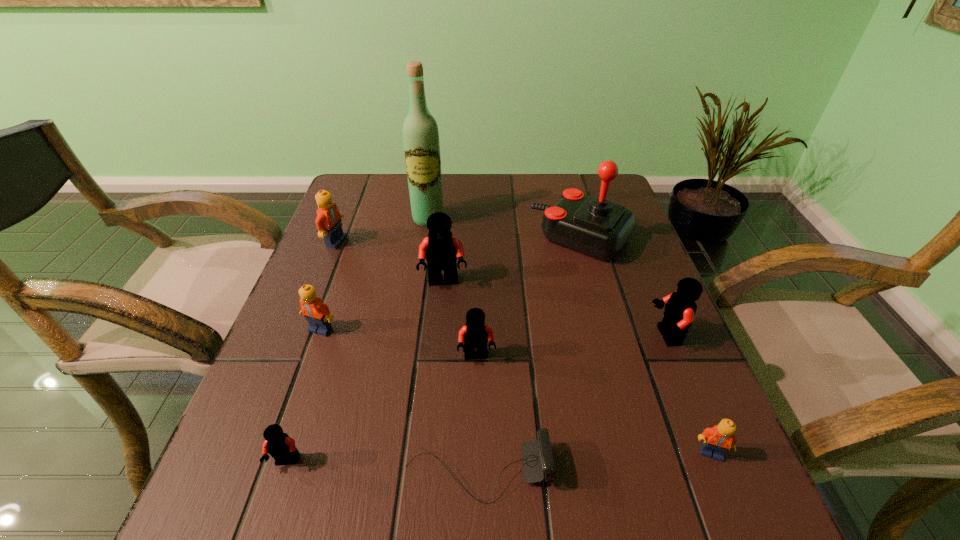
Find the location of `object that is at the near edge`. object that is at the near edge is located at coordinates (537, 459).

Where is `joystick present at the right edge`? The height and width of the screenshot is (540, 960). joystick present at the right edge is located at coordinates (595, 226).

What are the coordinates of `object that is at the far right corner` in the screenshot? It's located at (595, 226).

The width and height of the screenshot is (960, 540). Find the location of `vacant space at the far edge of the desktop`. vacant space at the far edge of the desktop is located at coordinates (504, 180).

Where is `free spot at the left edge of the desktop`? free spot at the left edge of the desktop is located at coordinates (325, 346).

Locate an element on the screen. This screenshot has width=960, height=540. free space at the right edge is located at coordinates (659, 348).

Where is `vacant space at the far left corner of the desktop`? This screenshot has width=960, height=540. vacant space at the far left corner of the desktop is located at coordinates (363, 189).

Locate an element on the screen. The width and height of the screenshot is (960, 540). vacant region between the second farthest Lego and the farthest Lego is located at coordinates (390, 262).

At what (x,y) coordinates should I click in order to perform the action: click on free space between the farthest orange Lego and the second smallest black Lego. Please return your answer as a coordinate pair (x, y). Image resolution: width=960 pixels, height=540 pixels. Looking at the image, I should click on (406, 299).

This screenshot has width=960, height=540. I want to click on free space that is in between the second tallest object and the biggest orange Lego, so click(459, 240).